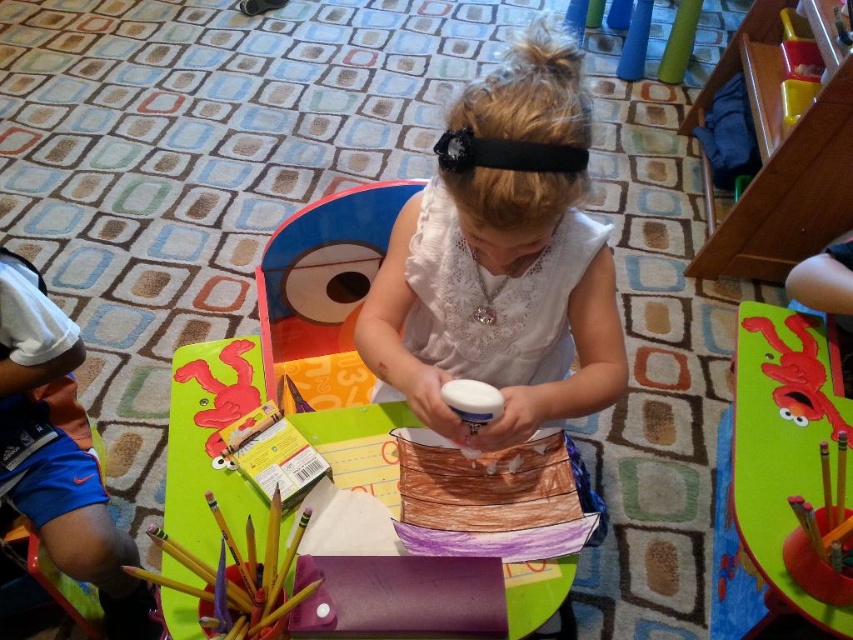
You are a teacher observing a student working on an art project. The student has a green matte board at center and a chocolate cake at center on the table. Which object is taller?

The green matte board at center is taller than the chocolate cake at center.

You are a teacher observing a child working on a craft project. The child has a green matte board at center and a chocolate cake at center on the table. Which object is wider?

The green matte board at center is wider than the chocolate cake at center.